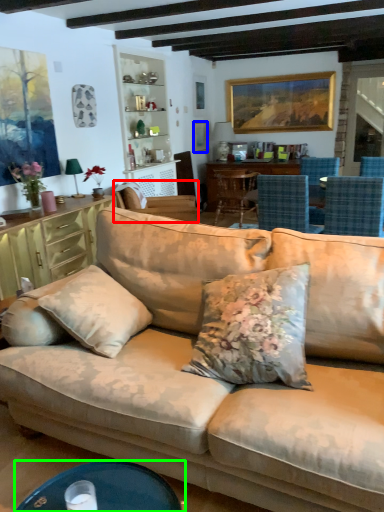
Question: Based on their relative distances, which object is nearer to chair (highlighted by a red box)? Choose from picture frame (highlighted by a blue box) and desk (highlighted by a green box).

Choices:
 (A) picture frame
 (B) desk

Answer: (A)